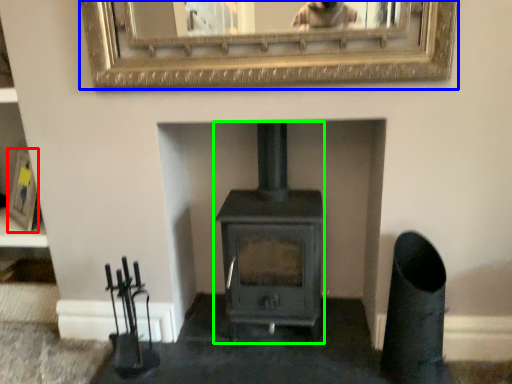
Question: Based on their relative distances, which object is farther from picture frame (highlighted by a red box)? Choose from picture frame (highlighted by a blue box) and wood burning stove (highlighted by a green box).

Choices:
 (A) picture frame
 (B) wood burning stove

Answer: (A)